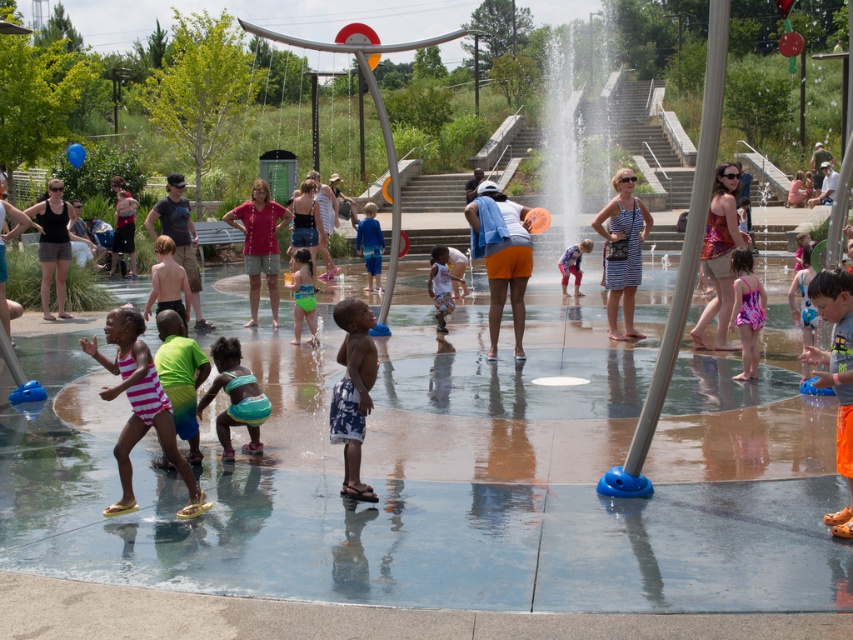
Question: Among these objects, which one is nearest to the camera?

Choices:
 (A) green fabric shorts at center
 (B) blue printed shorts at center
 (C) purple printed swimsuit at center
 (D) turquoise fabric swimsuit at center

Answer: (B)

Question: Which point is closer to the camera taking this photo?

Choices:
 (A) (720, 337)
 (B) (479, 202)
 (C) (339, 314)
 (D) (126, 355)

Answer: (D)

Question: Does turquoise fabric swimsuit at center appear on the left side of blue fabric swimsuit at center?

Choices:
 (A) no
 (B) yes

Answer: (B)

Question: Which of the following is the closest to the observer?

Choices:
 (A) (201, 323)
 (B) (28, 209)
 (C) (744, 282)

Answer: (C)

Question: Is matte black tank top at left bigger than white cotton shirt at center?

Choices:
 (A) yes
 (B) no

Answer: (A)

Question: Does transparent plastic water at center appear on the right side of white cotton shirt at center?

Choices:
 (A) yes
 (B) no

Answer: (A)